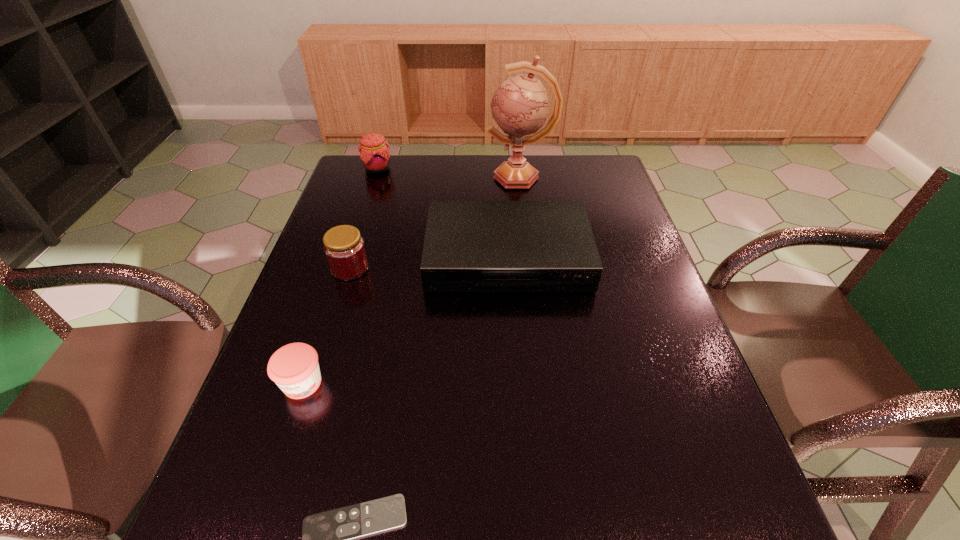
Find the location of a particular element. The image size is (960, 540). globe is located at coordinates (520, 107).

Find the location of a particular element. This screenshot has width=960, height=540. the farthest jam is located at coordinates (374, 154).

Where is `the second nearest jam`? The image size is (960, 540). the second nearest jam is located at coordinates (344, 248).

This screenshot has width=960, height=540. I want to click on CD player, so click(x=470, y=246).

Image resolution: width=960 pixels, height=540 pixels. I want to click on the nearest jam, so click(x=294, y=367).

You are a GUI agent. You are given a task and a screenshot of the screen. Output one action in this format:
    pyautogui.click(x=<x>, y=<y>)
    Task: Click on the second nearest object
    The width and height of the screenshot is (960, 540).
    Given the screenshot: What is the action you would take?
    pyautogui.click(x=294, y=367)

Where is `free spot located 0.190m on the front-facing side of the tallest object`? This screenshot has width=960, height=540. free spot located 0.190m on the front-facing side of the tallest object is located at coordinates (430, 177).

Find the location of `vacant region located 0.400m on the front-facing side of the tallest object`. vacant region located 0.400m on the front-facing side of the tallest object is located at coordinates (368, 177).

You are a GUI agent. You are given a task and a screenshot of the screen. Output one action in this format:
    pyautogui.click(x=<x>, y=<y>)
    Task: Click on the free region located on the front-facing side of the tallest object
    The image size is (960, 540).
    Given the screenshot: What is the action you would take?
    pyautogui.click(x=368, y=177)

Locate an element on the screen. free region located on the front of the farthest jam is located at coordinates (357, 230).